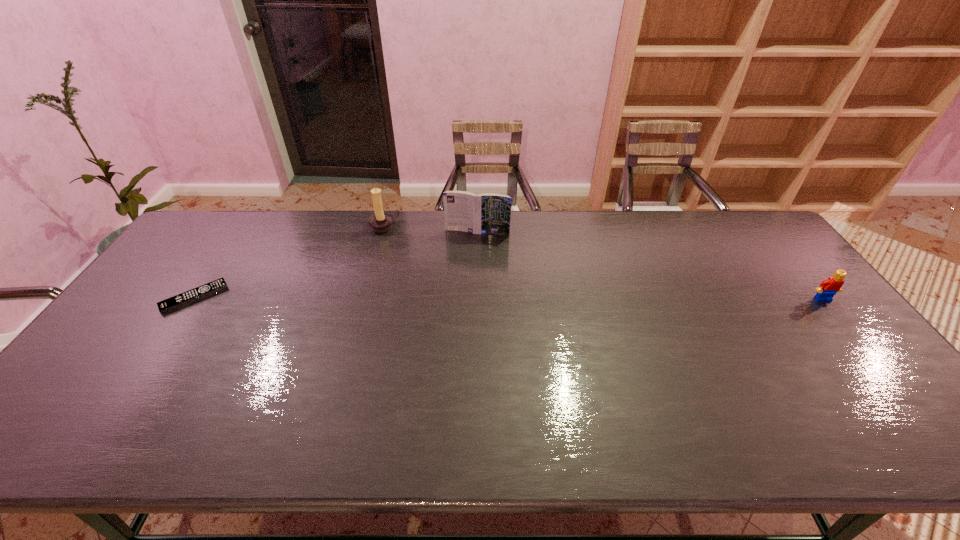
Locate an element on the screen. This screenshot has width=960, height=540. free space between the rightmost object and the remote control is located at coordinates (509, 299).

The width and height of the screenshot is (960, 540). I want to click on free space between the leftmost object and the Lego, so click(509, 299).

The image size is (960, 540). I want to click on unoccupied area between the shortest object and the second object from right to left, so click(x=336, y=265).

The width and height of the screenshot is (960, 540). Find the location of `vacant area that lies between the shortest object and the third object from right to left`. vacant area that lies between the shortest object and the third object from right to left is located at coordinates (289, 262).

I want to click on the third closest object to the second object from left to right, so click(x=828, y=288).

Locate an element on the screen. This screenshot has height=540, width=960. the closest object to the third object from left to right is located at coordinates (381, 221).

Locate an element on the screen. The image size is (960, 540). vacant space that satisfies the following two spatial constraints: 1. on the back side of the remote control; 2. on the right side of the book is located at coordinates 239,232.